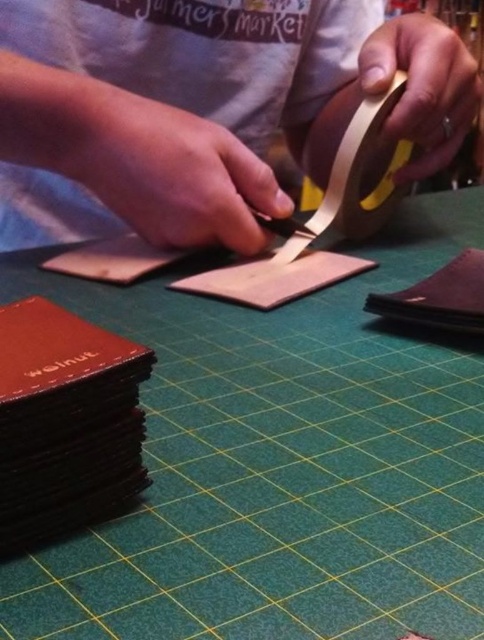
Who is positioned more to the right, green felt table at center or gold matte tape at upper right?

gold matte tape at upper right

Is green felt table at center thinner than gold matte tape at upper right?

No.

The width and height of the screenshot is (484, 640). I want to click on green felt table at center, so click(283, 461).

The height and width of the screenshot is (640, 484). What are the coordinates of `green felt table at center` in the screenshot? It's located at 283,461.

Between matte brown leather at center and gold matte tape at upper right, which one appears on the right side from the viewer's perspective?

From the viewer's perspective, gold matte tape at upper right appears more on the right side.

Between matte brown leather at center and gold matte tape at upper right, which one has more height?

matte brown leather at center

Is point (101, 88) more distant than point (382, 166)?

No, (101, 88) is in front of (382, 166).

The height and width of the screenshot is (640, 484). Identify the location of matte brown leather at center. pyautogui.click(x=205, y=109).

Which of these two, green felt table at center or matte brown leather at center, stands shorter?

green felt table at center

Is green felt table at center thinner than matte brown leather at center?

No.

This screenshot has height=640, width=484. Find the location of `green felt table at center`. green felt table at center is located at coordinates (283, 461).